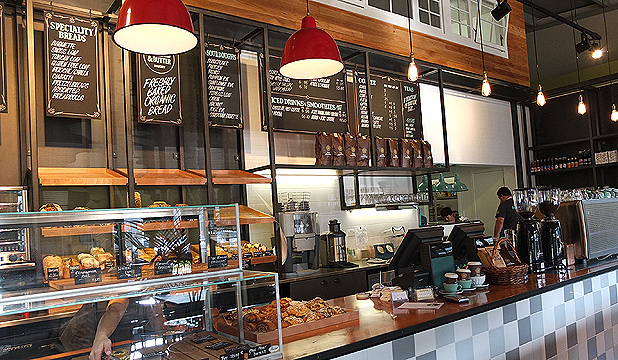
The width and height of the screenshot is (618, 360). What are the coordinates of `cash register screen` in the screenshot? It's located at (418, 239).